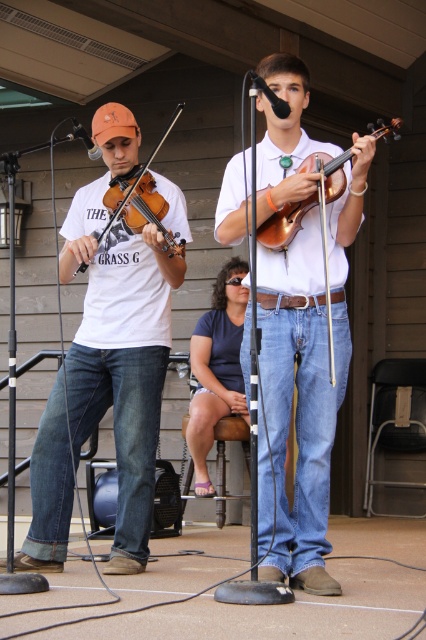
Does matte white t-shirt at left have a greater width compared to wooden violin at center?

Correct, the width of matte white t-shirt at left exceeds that of wooden violin at center.

In the scene shown: Is matte white t-shirt at left to the right of wooden violin at center from the viewer's perspective?

In fact, matte white t-shirt at left is to the left of wooden violin at center.

Between point (115, 548) and point (336, 164), which one is positioned in front?

Point (336, 164) is more forward.

You are a GUI agent. You are given a task and a screenshot of the screen. Output one action in this format:
    pyautogui.click(x=<x>, y=<y>)
    Task: Click on the matte white t-shirt at left
    
    Given the screenshot: What is the action you would take?
    pyautogui.click(x=121, y=328)

Is matte white t-shirt at left closer to the viewer compared to matte brown violin at left?

Yes, it is in front of matte brown violin at left.

Is matte white t-shirt at left taller than matte brown violin at left?

Correct, matte white t-shirt at left is much taller as matte brown violin at left.

Does point (146, 294) come closer to viewer compared to point (150, 157)?

No, it is not.

You are a GUI agent. You are given a task and a screenshot of the screen. Output one action in this format:
    pyautogui.click(x=<x>, y=<y>)
    Task: Click on the matte white t-shirt at left
    
    Given the screenshot: What is the action you would take?
    pyautogui.click(x=121, y=328)

Is matte brown violin at center thinner than matte brown violin at left?

In fact, matte brown violin at center might be wider than matte brown violin at left.

Does matte brown violin at center have a larger size compared to matte brown violin at left?

Indeed, matte brown violin at center has a larger size compared to matte brown violin at left.

Measure the distance between matte brown violin at center and camera.

5.28 meters

Where is `matte brown violin at center`? matte brown violin at center is located at coordinates (307, 376).